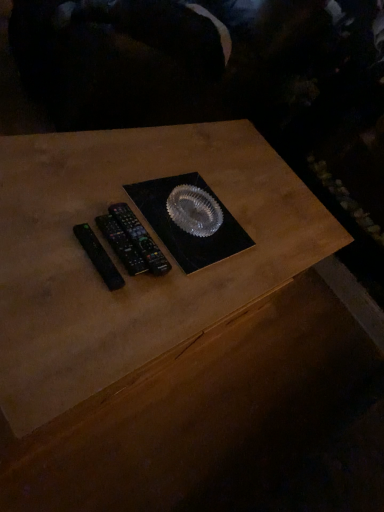
Locate an element on the screen. This screenshot has width=384, height=512. unoccupied area behind black plastic remote at left, placed as the third control when sorted from back to front is located at coordinates (142, 215).